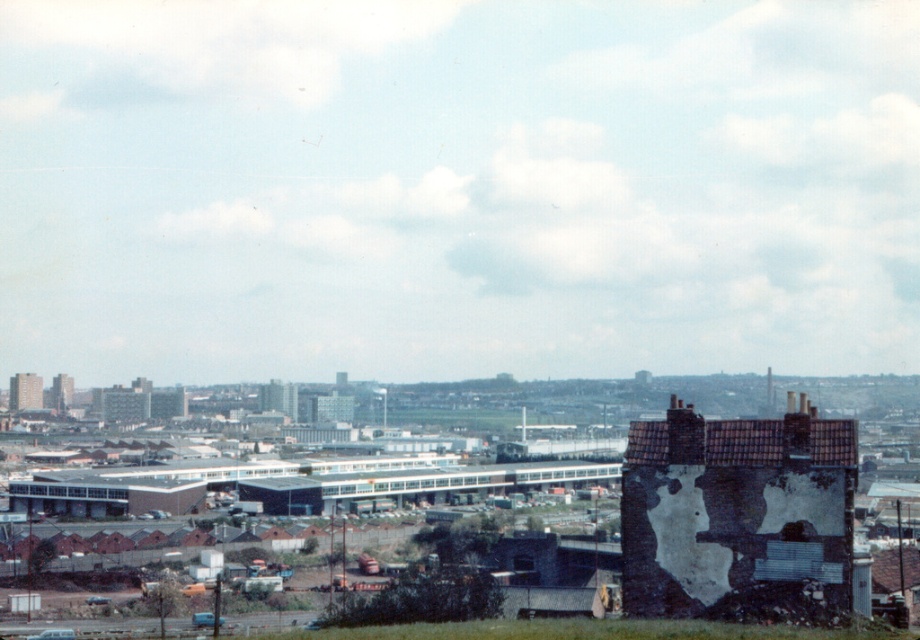
Question: Can you confirm if white plastered wall at center is positioned to the right of brick building at center?

Choices:
 (A) yes
 (B) no

Answer: (A)

Question: In this image, where is white plastered wall at center located relative to brick tower at upper left?

Choices:
 (A) left
 (B) right

Answer: (B)

Question: Among these objects, which one is nearest to the camera?

Choices:
 (A) white plastered wall at center
 (B) brick building at center

Answer: (A)

Question: Based on their relative distances, which object is farther from the white plastered wall at center?

Choices:
 (A) brick building at center
 (B) brick tower at upper left

Answer: (A)

Question: Which object is positioned farthest from the white plastered wall at center?

Choices:
 (A) brick tower at upper left
 (B) brick building at center

Answer: (B)

Question: From the image, what is the correct spatial relationship of white plastered wall at center in relation to brick tower at upper left?

Choices:
 (A) left
 (B) right

Answer: (B)